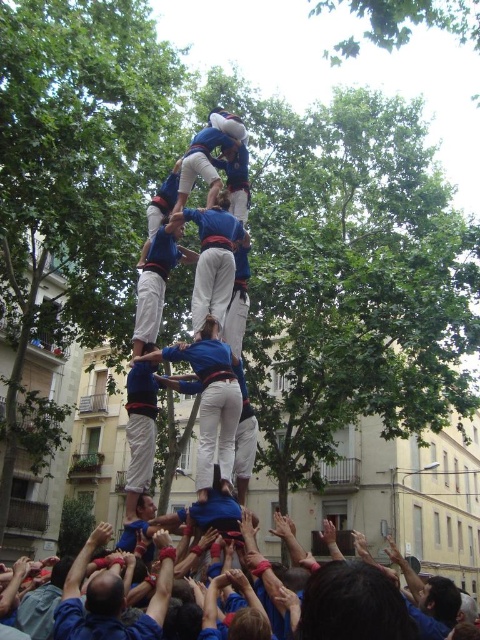
Measure the distance from blue fabric human at center to blue fabric hands at lower center.

They are 22.52 meters apart.

Is blue fabric human at center bigger than blue fabric hands at lower center?

Indeed, blue fabric human at center has a larger size compared to blue fabric hands at lower center.

Is point (196, 324) behind point (74, 579)?

Yes, point (196, 324) is behind point (74, 579).

The height and width of the screenshot is (640, 480). I want to click on blue fabric human at center, so click(212, 216).